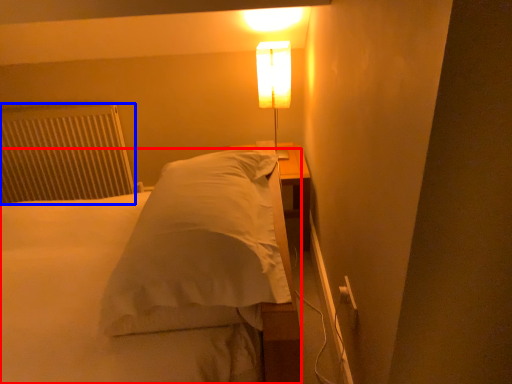
Question: Which object appears closest to the camera in this image, bed (highlighted by a red box) or radiator (highlighted by a blue box)?

Choices:
 (A) bed
 (B) radiator

Answer: (A)